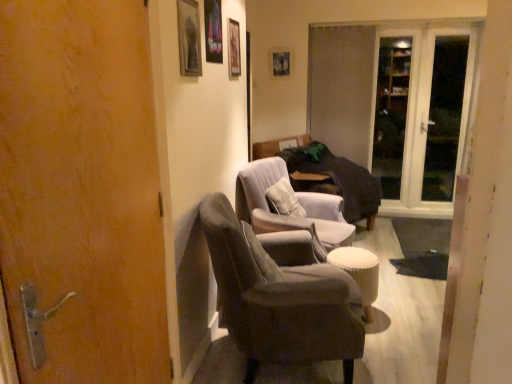
Question: Should I look upward or downward to see white glass door at upper right?

Choices:
 (A) up
 (B) down

Answer: (A)

Question: Is metallic glass picture frame at upper center, positioned as the 3th picture frame in right-to-left order, inside velvet grey armchair at center, which is the second chair from back to front?

Choices:
 (A) yes
 (B) no

Answer: (B)

Question: Is there a large distance between velvet grey armchair at center, which is the 1th chair in front-to-back order, and metallic glass picture frame at upper center, acting as the second picture frame starting from the front?

Choices:
 (A) no
 (B) yes

Answer: (B)

Question: Considering the relative positions of velvet grey armchair at center, which is the second chair from back to front, and metallic glass picture frame at upper center, acting as the second picture frame starting from the front, in the image provided, is velvet grey armchair at center, which is the second chair from back to front, to the left of metallic glass picture frame at upper center, acting as the second picture frame starting from the front, from the viewer's perspective?

Choices:
 (A) no
 (B) yes

Answer: (A)

Question: Is velvet grey armchair at center, which is the second chair from back to front, positioned with its back to metallic glass picture frame at upper center, acting as the second picture frame starting from the front?

Choices:
 (A) no
 (B) yes

Answer: (A)

Question: Does velvet grey armchair at center, which is the second chair from back to front, come behind metallic glass picture frame at upper center, arranged as the second picture frame when viewed from the left?

Choices:
 (A) no
 (B) yes

Answer: (A)

Question: Considering the relative sizes of velvet grey armchair at center, which is the 1th chair in front-to-back order, and metallic glass picture frame at upper center, positioned as the 3th picture frame in right-to-left order, in the image provided, is velvet grey armchair at center, which is the 1th chair in front-to-back order, bigger than metallic glass picture frame at upper center, positioned as the 3th picture frame in right-to-left order,?

Choices:
 (A) no
 (B) yes

Answer: (B)

Question: Does transparent glass screen door at right, which appears as the 2th screen door when viewed from the right, appear on the right side of wooden picture frame at upper center, the 1th picture frame viewed from the back?

Choices:
 (A) no
 (B) yes

Answer: (B)

Question: From the image's perspective, would you say transparent glass screen door at right, placed as the 2th screen door when sorted from left to right, is positioned over wooden picture frame at upper center, the first picture frame positioned from the right?

Choices:
 (A) no
 (B) yes

Answer: (A)

Question: Considering the relative positions of transparent glass screen door at right, which appears as the 2th screen door when viewed from the right, and wooden picture frame at upper center, the fourth picture frame in the front-to-back sequence, in the image provided, is transparent glass screen door at right, which appears as the 2th screen door when viewed from the right, behind wooden picture frame at upper center, the fourth picture frame in the front-to-back sequence,?

Choices:
 (A) no
 (B) yes

Answer: (A)

Question: Is transparent glass screen door at right, which appears as the 2th screen door when viewed from the right, shorter than wooden picture frame at upper center, acting as the 4th picture frame starting from the left?

Choices:
 (A) yes
 (B) no

Answer: (B)

Question: Does transparent glass screen door at right, which appears as the 2th screen door when viewed from the right, have a greater height compared to wooden picture frame at upper center, the fourth picture frame in the front-to-back sequence?

Choices:
 (A) no
 (B) yes

Answer: (B)

Question: Is transparent glass screen door at right, which appears as the 2th screen door when viewed from the right, outside of wooden picture frame at upper center, the first picture frame positioned from the right?

Choices:
 (A) yes
 (B) no

Answer: (A)

Question: Is velvet grey armchair at center, which is the second chair from back to front, oriented away from white glass door at upper right?

Choices:
 (A) yes
 (B) no

Answer: (B)